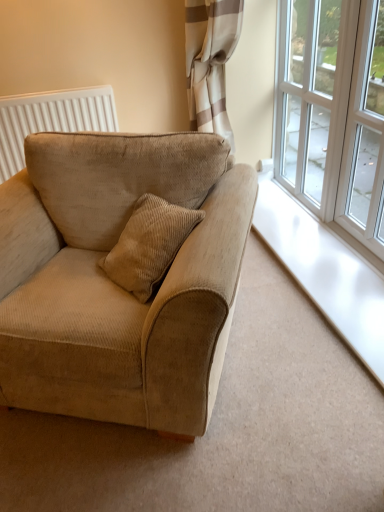
Question: Considering the positions of white textured radiator at upper left and clear glass window at upper right, which is the 1th window in front-to-back order, in the image, is white textured radiator at upper left wider or thinner than clear glass window at upper right, which is the 1th window in front-to-back order,?

Choices:
 (A) wide
 (B) thin

Answer: (A)

Question: From a real-world perspective, is white textured radiator at upper left above or below clear glass window at upper right, which is counted as the 2th window, starting from the back?

Choices:
 (A) below
 (B) above

Answer: (A)

Question: Considering the real-world distances, which object is closest to the white textured radiator at upper left?

Choices:
 (A) clear glass window at upper right, which is counted as the 2th window, starting from the back
 (B) white glass window at upper right, which ranks as the 1th window in back-to-front order
 (C) beige corduroy couch at left

Answer: (C)

Question: Estimate the real-world distances between objects in this image. Which object is farther from the white glass window at upper right, which is the second window from front to back?

Choices:
 (A) clear glass window at upper right, which is counted as the 2th window, starting from the back
 (B) beige corduroy couch at left
 (C) white textured radiator at upper left

Answer: (C)